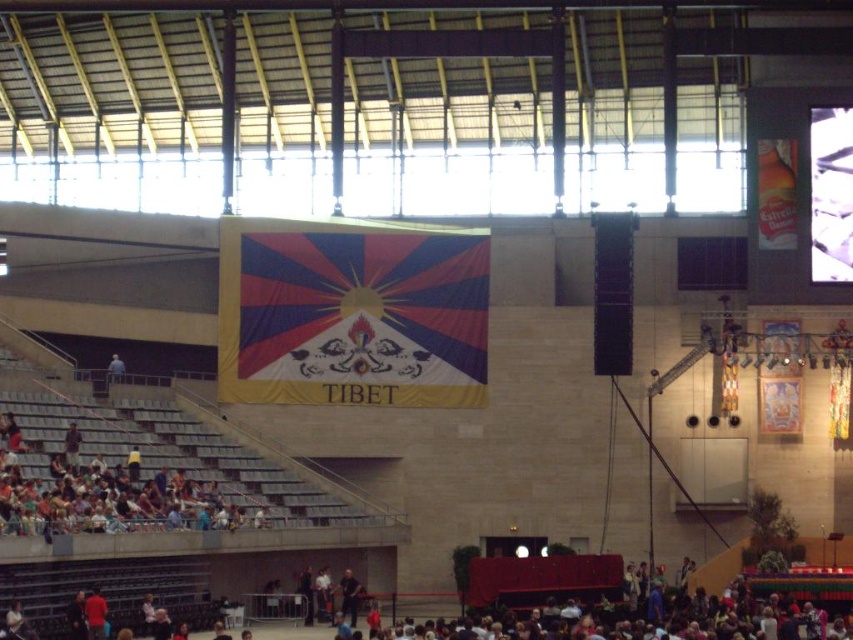
Can you confirm if red fabric shirt at lower left is smaller than dark blue shirt at lower left?

Actually, red fabric shirt at lower left might be larger than dark blue shirt at lower left.

Does red fabric shirt at lower left appear over dark blue shirt at lower left?

Incorrect, red fabric shirt at lower left is not positioned above dark blue shirt at lower left.

Describe the element at coordinates (96, 614) in the screenshot. I see `red fabric shirt at lower left` at that location.

Locate an element on the screen. red fabric shirt at lower left is located at coordinates (96, 614).

Can you confirm if red fabric shirt at lower left is bigger than dark blue shirt at center?

Incorrect, red fabric shirt at lower left is not larger than dark blue shirt at center.

Is point (86, 612) more distant than point (349, 620)?

No, it is not.

This screenshot has height=640, width=853. In order to click on red fabric shirt at lower left in this screenshot , I will do `click(96, 614)`.

At what (x,y) coordinates should I click in order to perform the action: click on dark blue shirt at lower left. Please return your answer as a coordinate pair (x, y). Looking at the image, I should click on (71, 445).

This screenshot has width=853, height=640. What do you see at coordinates (71, 445) in the screenshot?
I see `dark blue shirt at lower left` at bounding box center [71, 445].

Image resolution: width=853 pixels, height=640 pixels. What do you see at coordinates (71, 445) in the screenshot?
I see `dark blue shirt at lower left` at bounding box center [71, 445].

Locate an element on the screen. The image size is (853, 640). dark blue shirt at lower left is located at coordinates pyautogui.click(x=71, y=445).